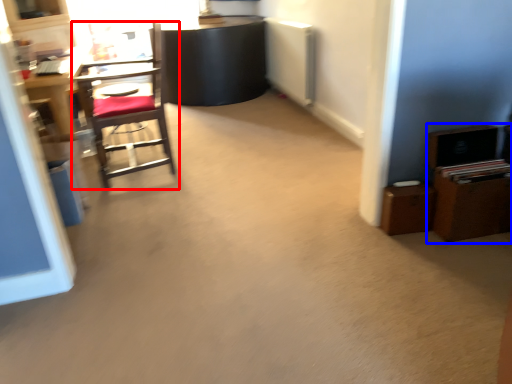
Question: Among these objects, which one is farthest to the camera, chair (highlighted by a red box) or dresser (highlighted by a blue box)?

Choices:
 (A) chair
 (B) dresser

Answer: (A)